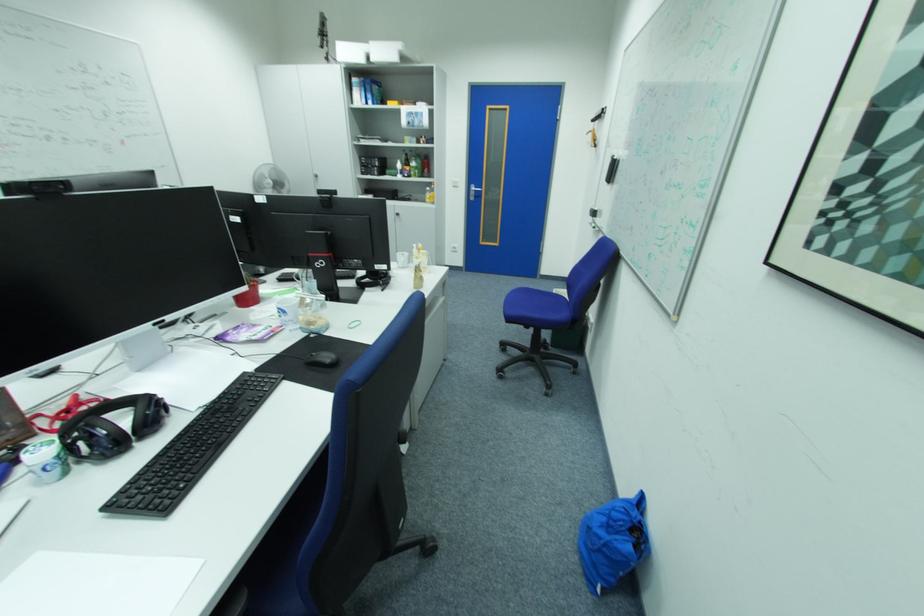
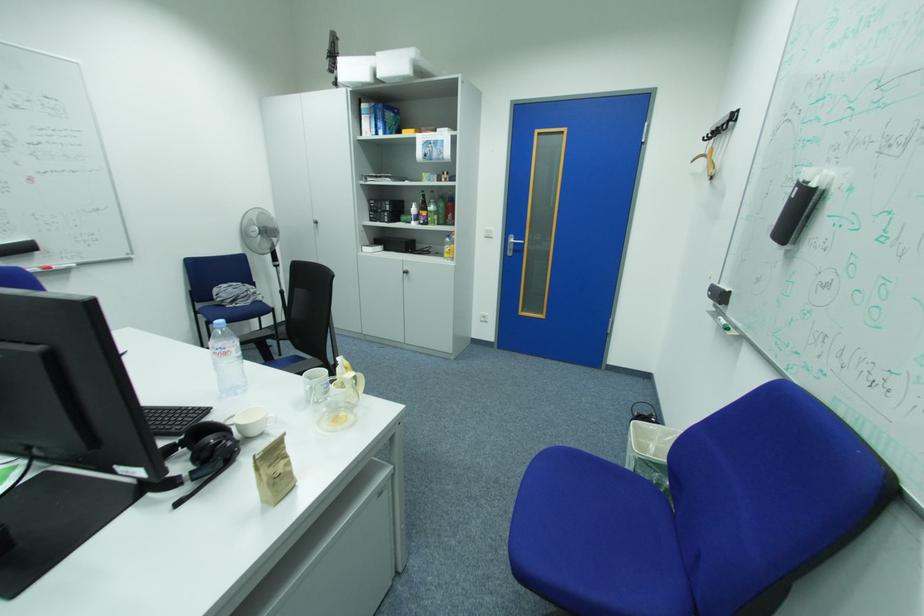
Where in the second image is the point corresponding to point (408, 168) from the first image?

(422, 211)